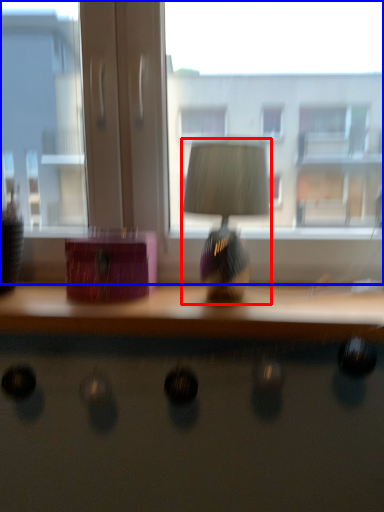
Question: Which of the following is the farthest to the observer, table lamp (highlighted by a red box) or window (highlighted by a blue box)?

Choices:
 (A) table lamp
 (B) window

Answer: (B)